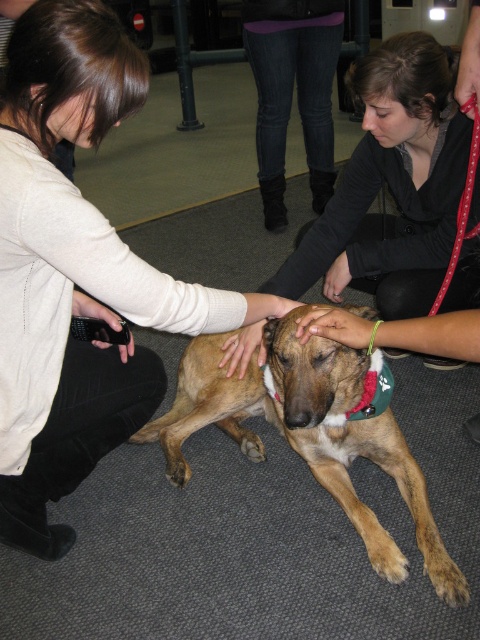
Which is behind, point (93, 68) or point (427, 528)?

Positioned behind is point (427, 528).

In order to click on matte beige sweater at center in this screenshot , I will do `click(74, 273)`.

Who is taller, matte black shirt at center or brown furry dog at center?

With more height is matte black shirt at center.

This screenshot has width=480, height=640. What do you see at coordinates (392, 184) in the screenshot? I see `matte black shirt at center` at bounding box center [392, 184].

At what (x,y) coordinates should I click in order to perform the action: click on matte black shirt at center. Please return your answer as a coordinate pair (x, y). Looking at the image, I should click on (392, 184).

Between matte beige sweater at center and matte black shirt at center, which one has less height?

matte black shirt at center is shorter.

Does matte beige sweater at center have a greater height compared to matte black shirt at center?

Correct, matte beige sweater at center is much taller as matte black shirt at center.

The height and width of the screenshot is (640, 480). Identify the location of matte beige sweater at center. (74, 273).